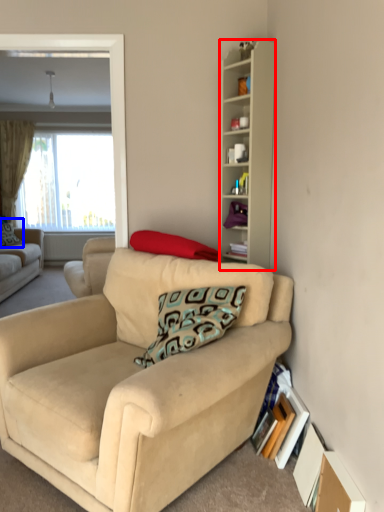
Question: Which of the following is the farthest to the observer, cabinetry (highlighted by a red box) or pillow (highlighted by a blue box)?

Choices:
 (A) cabinetry
 (B) pillow

Answer: (B)